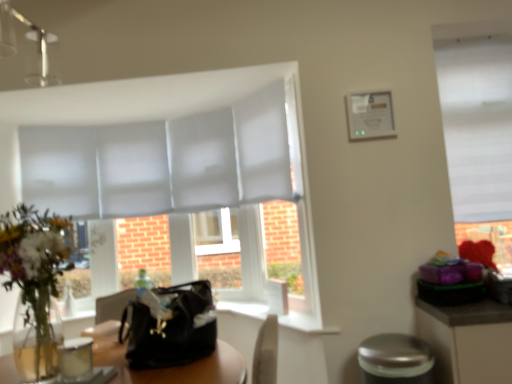
Question: Is silver metallic bar stool at lower right in front of or behind translucent glass vase at left in the image?

Choices:
 (A) front
 (B) behind

Answer: (B)

Question: From a real-world perspective, is silver metallic bar stool at lower right positioned above or below translucent glass vase at left?

Choices:
 (A) above
 (B) below

Answer: (B)

Question: Estimate the real-world distances between objects in this image. Which object is closer to the silver metallic bar stool at lower right?

Choices:
 (A) black leather handbag at center
 (B) white smooth window sill at center
 (C) white matte window at upper right
 (D) translucent glass vase at left

Answer: (B)

Question: Which object is positioned closest to the white smooth window sill at center?

Choices:
 (A) black leather handbag at center
 (B) translucent glass vase at left
 (C) silver metallic bar stool at lower right
 (D) white matte window at upper right

Answer: (C)